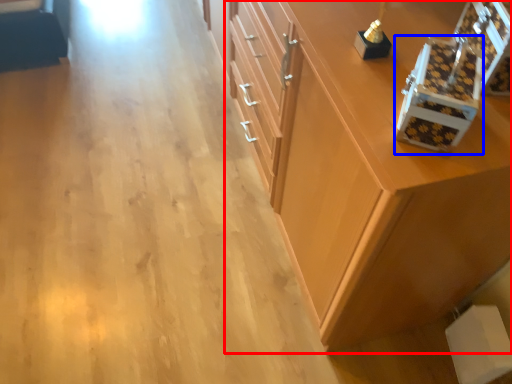
Question: Which object appears farthest to the camera in this image, cabinetry (highlighted by a red box) or box (highlighted by a blue box)?

Choices:
 (A) cabinetry
 (B) box

Answer: (A)